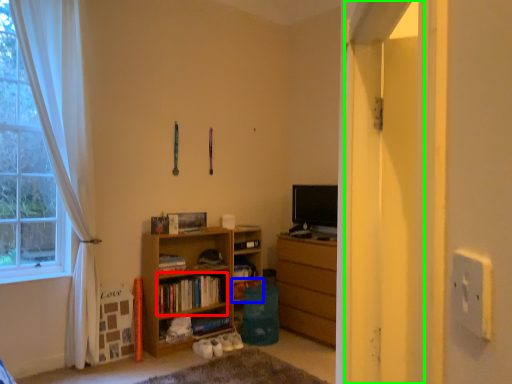
Question: Which is farther away from book (highlighted by a red box)? shelf (highlighted by a blue box) or screen door (highlighted by a green box)?

Choices:
 (A) shelf
 (B) screen door

Answer: (B)